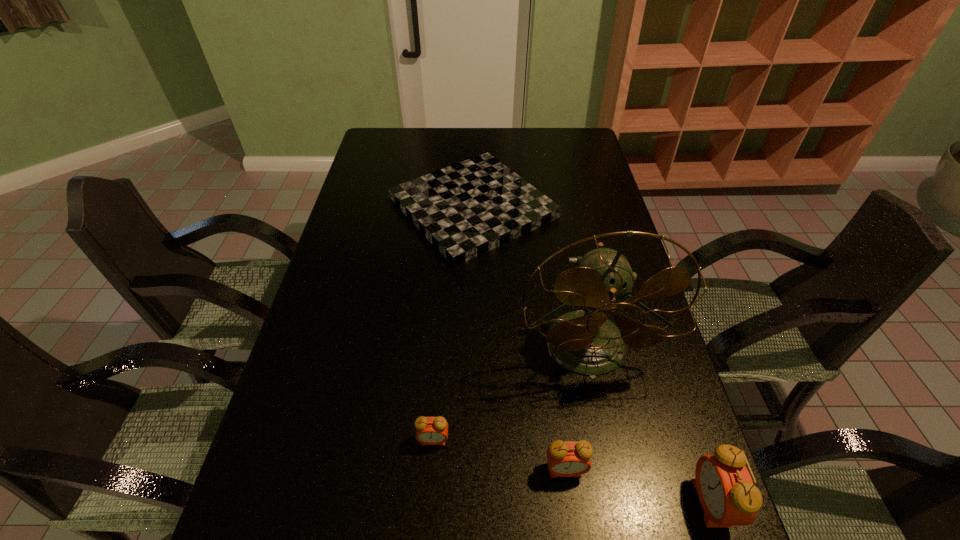
The image size is (960, 540). Find the location of `the third farthest object`. the third farthest object is located at coordinates (429, 430).

The image size is (960, 540). Identify the location of the farthest alarm clock. (429, 430).

Locate an element on the screen. the second shortest alarm clock is located at coordinates (565, 459).

This screenshot has width=960, height=540. Identify the location of the third shortest object. (565, 459).

At what (x,y) coordinates should I click in order to perform the action: click on the fourth shortest object. Please return your answer as a coordinate pair (x, y). The height and width of the screenshot is (540, 960). Looking at the image, I should click on (725, 488).

Identify the location of the rightmost alarm clock. Image resolution: width=960 pixels, height=540 pixels. (725, 488).

At what (x,y) coordinates should I click in order to perform the action: click on checkerboard. Please return your answer as a coordinate pair (x, y). This screenshot has height=540, width=960. Looking at the image, I should click on (467, 209).

The image size is (960, 540). In order to click on the shortest object in this screenshot , I will do `click(467, 209)`.

Identify the location of the second farthest object. The width and height of the screenshot is (960, 540). (586, 342).

At what (x,y) coordinates should I click in order to perform the action: click on fan. Please return your answer as a coordinate pair (x, y). The width and height of the screenshot is (960, 540). Looking at the image, I should click on (586, 342).